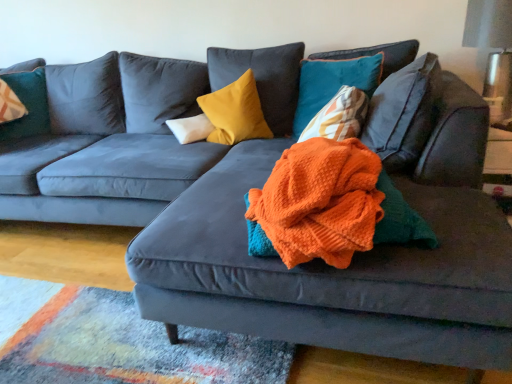
Question: Is velvet teal pillow at upper left, placed as the 1th pillow when sorted from left to right, behind white soft pillow at center, which is counted as the 3th pillow, starting from the right?

Choices:
 (A) no
 (B) yes

Answer: (B)

Question: Could you tell me if velvet teal pillow at upper left, which is the fourth pillow in right-to-left order, is facing white soft pillow at center, which is counted as the 3th pillow, starting from the right?

Choices:
 (A) yes
 (B) no

Answer: (A)

Question: From the image's perspective, is velvet teal pillow at upper left, which is the fourth pillow in right-to-left order, located beneath white soft pillow at center, which is counted as the 3th pillow, starting from the right?

Choices:
 (A) no
 (B) yes

Answer: (A)

Question: Can you confirm if velvet teal pillow at upper left, which is the fourth pillow in right-to-left order, is bigger than white soft pillow at center, which is counted as the 3th pillow, starting from the right?

Choices:
 (A) yes
 (B) no

Answer: (A)

Question: Considering the relative sizes of velvet teal pillow at upper left, placed as the 1th pillow when sorted from left to right, and white soft pillow at center, which is counted as the second pillow, starting from the left, in the image provided, is velvet teal pillow at upper left, placed as the 1th pillow when sorted from left to right, taller than white soft pillow at center, which is counted as the second pillow, starting from the left,?

Choices:
 (A) no
 (B) yes

Answer: (B)

Question: Considering the relative sizes of velvet teal pillow at upper left, placed as the 1th pillow when sorted from left to right, and white soft pillow at center, which is counted as the second pillow, starting from the left, in the image provided, is velvet teal pillow at upper left, placed as the 1th pillow when sorted from left to right, smaller than white soft pillow at center, which is counted as the second pillow, starting from the left,?

Choices:
 (A) no
 (B) yes

Answer: (A)

Question: Is teal velvet pillow at upper right, positioned as the 4th pillow in left-to-right order, smaller than orange knitted blanket at center?

Choices:
 (A) yes
 (B) no

Answer: (B)

Question: Is teal velvet pillow at upper right, positioned as the 4th pillow in left-to-right order, bigger than orange knitted blanket at center?

Choices:
 (A) yes
 (B) no

Answer: (A)

Question: Can we say teal velvet pillow at upper right, positioned as the 4th pillow in left-to-right order, lies outside orange knitted blanket at center?

Choices:
 (A) yes
 (B) no

Answer: (A)

Question: Considering the relative positions of teal velvet pillow at upper right, the first pillow when ordered from right to left, and orange knitted blanket at center in the image provided, is teal velvet pillow at upper right, the first pillow when ordered from right to left, behind orange knitted blanket at center?

Choices:
 (A) no
 (B) yes

Answer: (B)

Question: From a real-world perspective, is teal velvet pillow at upper right, the first pillow when ordered from right to left, over orange knitted blanket at center?

Choices:
 (A) yes
 (B) no

Answer: (A)

Question: Is orange knitted blanket at center completely or partially inside teal velvet pillow at upper right, the first pillow when ordered from right to left?

Choices:
 (A) no
 (B) yes

Answer: (A)

Question: From the image's perspective, is white soft pillow at center, which is counted as the 3th pillow, starting from the right, under orange knitted blanket at center?

Choices:
 (A) yes
 (B) no

Answer: (B)